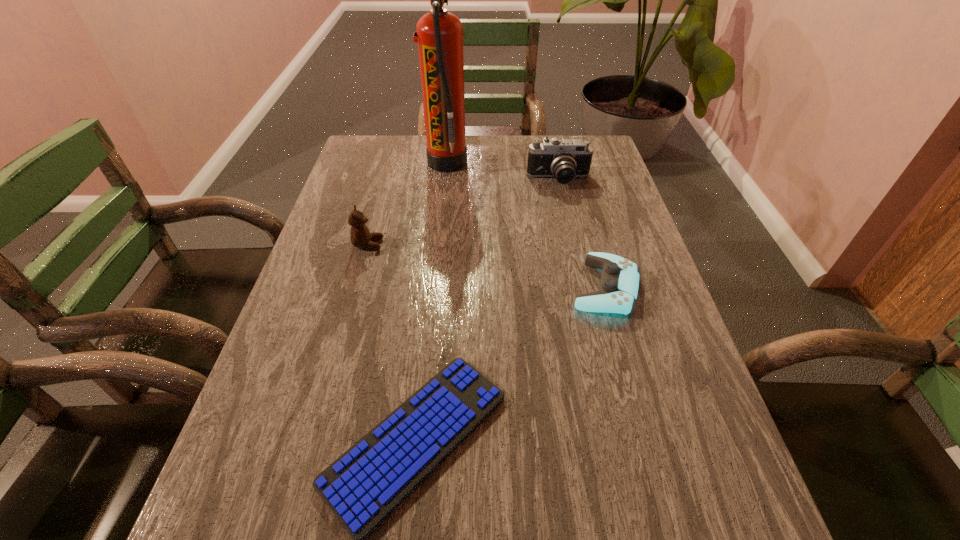
The image size is (960, 540). What are the coordinates of `empty space between the teddy bear and the second nearest object` in the screenshot? It's located at (487, 266).

This screenshot has width=960, height=540. Find the location of `free space between the camera and the third nearest object`. free space between the camera and the third nearest object is located at coordinates (464, 212).

Find the location of a particular element. free space between the second nearest object and the fire extinguisher is located at coordinates (526, 225).

The image size is (960, 540). Find the location of `vacant area that lies between the second shortest object and the fire extinguisher`. vacant area that lies between the second shortest object and the fire extinguisher is located at coordinates (526, 225).

This screenshot has width=960, height=540. Identify the location of unoccupied area between the second shortest object and the fire extinguisher. (526, 225).

Point out which object is positioned as the fourth nearest to the computer keyboard. Please provide its 2D coordinates. Your answer should be formatted as a tuple, i.e. [(x, y)], where the tuple contains the x and y coordinates of a point satisfying the conditions above.

[(439, 35)]

Locate an element on the screen. The height and width of the screenshot is (540, 960). object that is the closest to the shortest object is located at coordinates (618, 288).

The image size is (960, 540). What are the coordinates of `free location that satisfies the following two spatial constraints: 1. at the face of the teddy bear; 2. on the right side of the second nearest object` in the screenshot? It's located at (356, 287).

The image size is (960, 540). I want to click on free location that satisfies the following two spatial constraints: 1. at the face of the third nearest object; 2. on the right side of the control, so click(356, 287).

You are a GUI agent. You are given a task and a screenshot of the screen. Output one action in this format:
    pyautogui.click(x=<x>, y=<y>)
    Task: Click on the free location that satisfies the following two spatial constraints: 1. on the front-facing side of the camera; 2. at the face of the third nearest object
    
    Given the screenshot: What is the action you would take?
    pyautogui.click(x=573, y=244)